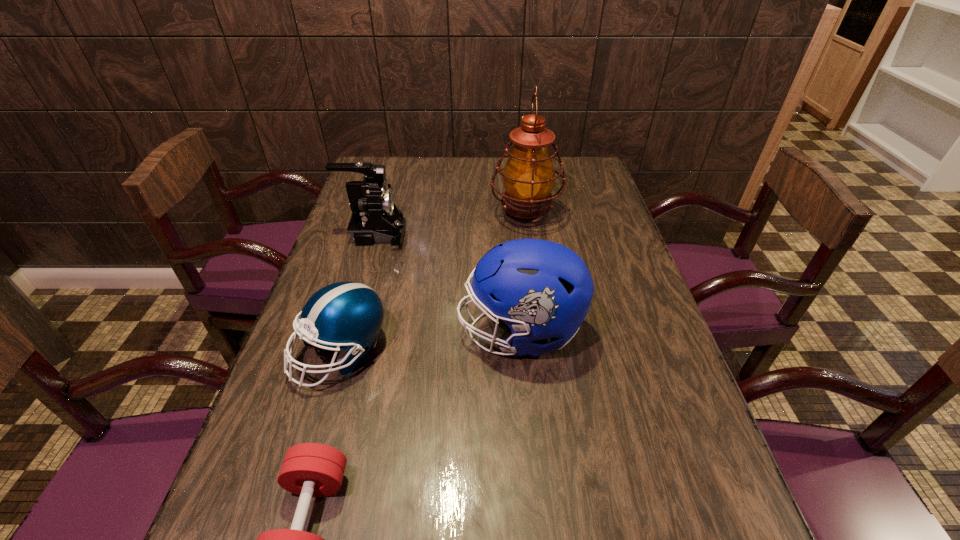
Locate which object is the third closest to the camcorder. Please provide its 2D coordinates. Your answer should be formatted as a tuple, i.e. [(x, y)], where the tuple contains the x and y coordinates of a point satisfying the conditions above.

[(540, 289)]

The height and width of the screenshot is (540, 960). In order to click on vacant space that satisfies the following two spatial constraints: 1. on the face guard of the right football helmet; 2. at the front of the shorter football helmet with the faceguard in this screenshot , I will do `click(521, 352)`.